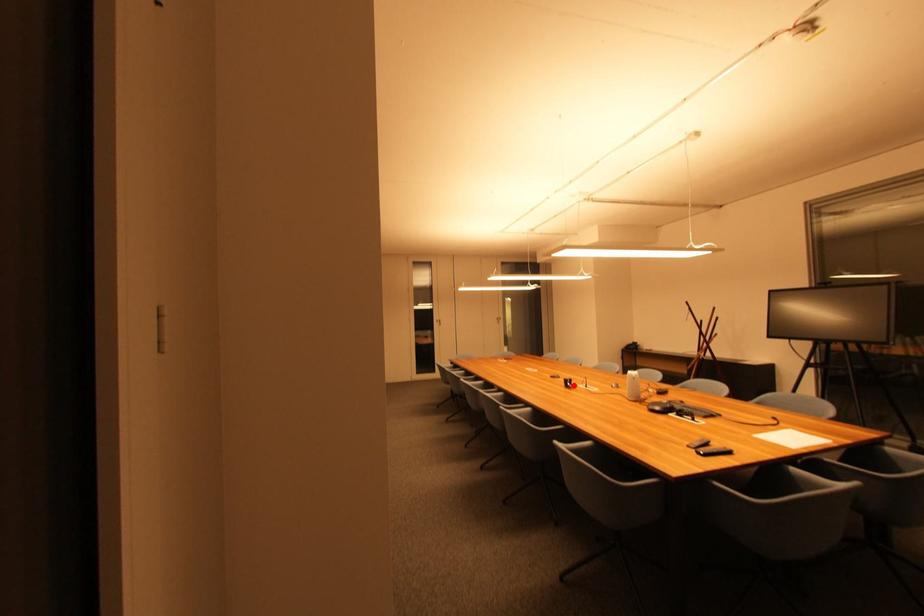
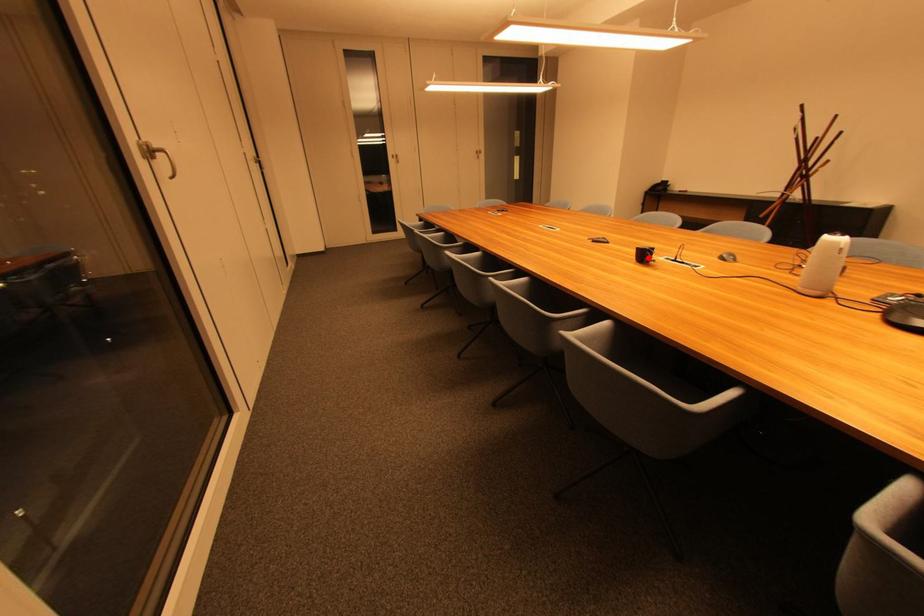
In the scene shown: I am providing you with two images of the same scene from different viewpoints. A red point is marked on the first image and another point is marked on the second image. Is the marked point in image1 the same physical position as the marked point in image2?

Yes